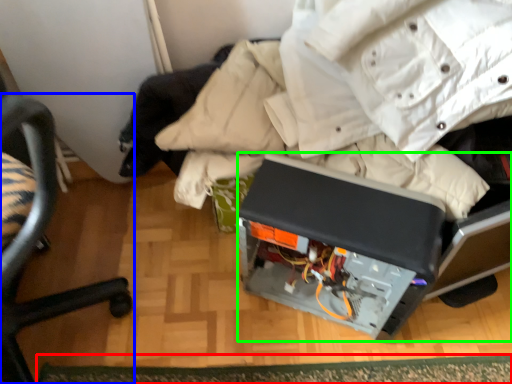
Question: Which object is positioned closest to mat (highlighted by a red box)? Select from chair (highlighted by a blue box) and wide (highlighted by a green box).

Choices:
 (A) chair
 (B) wide

Answer: (B)